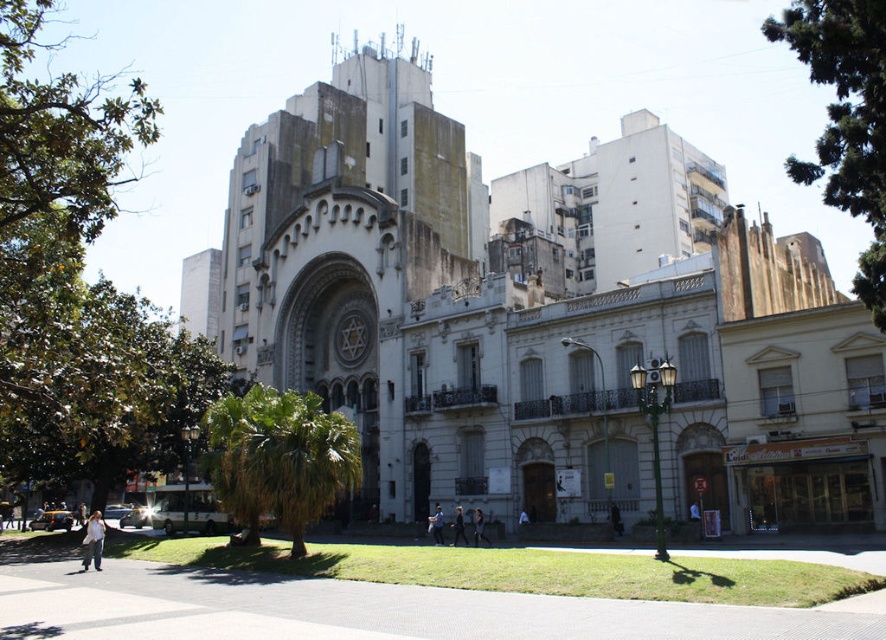
Question: Which object is farther from the camera taking this photo?

Choices:
 (A) white stone church at center
 (B) black leather jacket at center
 (C) light blue denim jeans at lower left

Answer: (B)

Question: Is dark brown leather jacket at center below black leather jacket at center?

Choices:
 (A) yes
 (B) no

Answer: (B)

Question: Which object is positioned closest to the dark blue jeans at center?

Choices:
 (A) black leather jacket at center
 (B) dark brown leather jacket at center
 (C) light blue denim jeans at lower left
 (D) white stone church at center

Answer: (A)

Question: Is light blue denim jeans at lower left wider than black leather jacket at center?

Choices:
 (A) yes
 (B) no

Answer: (A)

Question: Estimate the real-world distances between objects in this image. Which object is closer to the dark brown leather jacket at center?

Choices:
 (A) white stone church at center
 (B) black leather jacket at center
 (C) dark blue jeans at center

Answer: (B)

Question: Considering the relative positions of light blue denim jeans at lower left and dark blue jeans at center in the image provided, where is light blue denim jeans at lower left located with respect to dark blue jeans at center?

Choices:
 (A) left
 (B) right

Answer: (A)